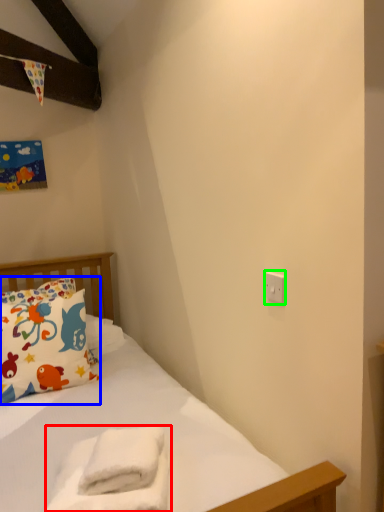
Question: Estimate the real-world distances between objects in this image. Which object is farther from material (highlighted by a red box), pillow (highlighted by a blue box) or electric outlet (highlighted by a green box)?

Choices:
 (A) pillow
 (B) electric outlet

Answer: (A)